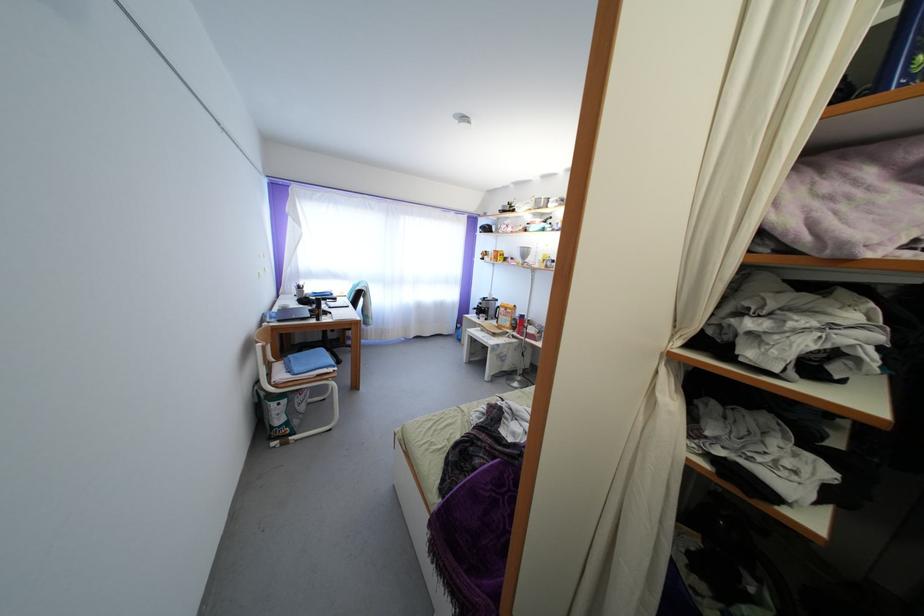
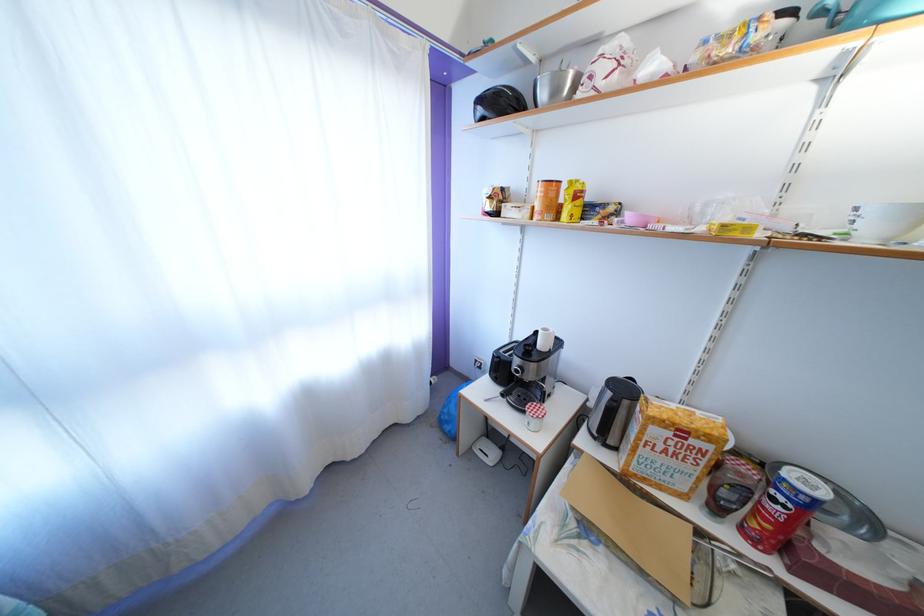
In the second image, find the point that corresponds to (487,233) in the first image.

(484, 107)